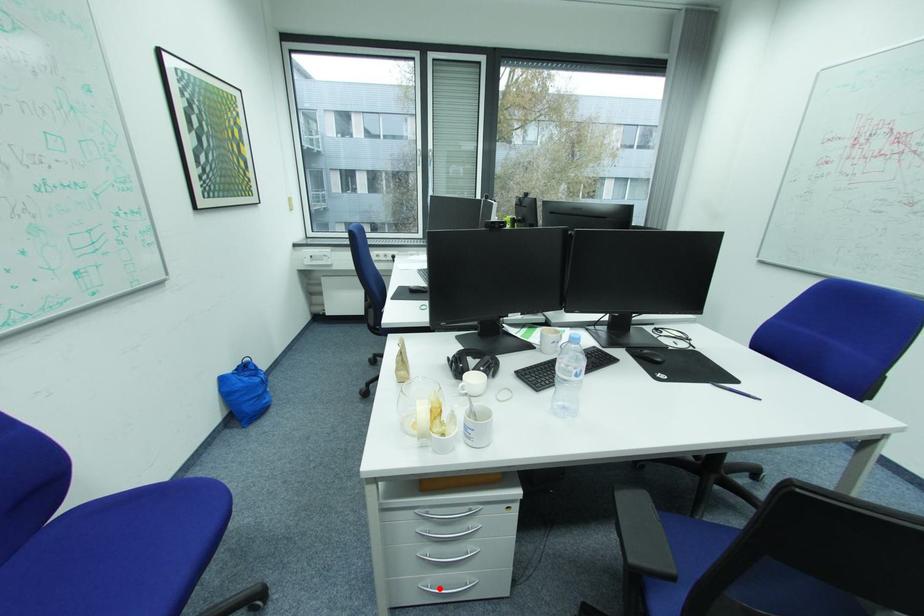
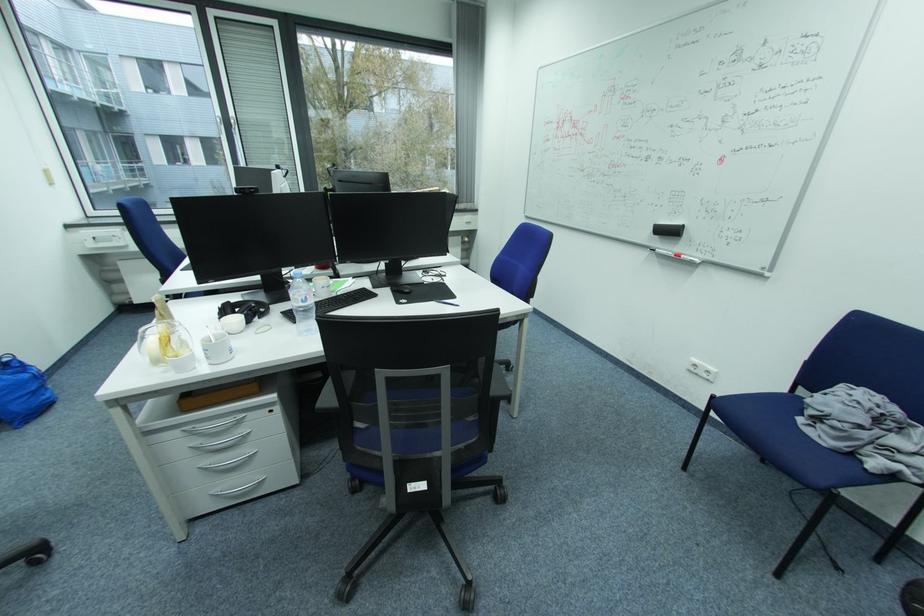
Where in the second image is the point corresponding to the highlighted location from the first image?

(229, 493)